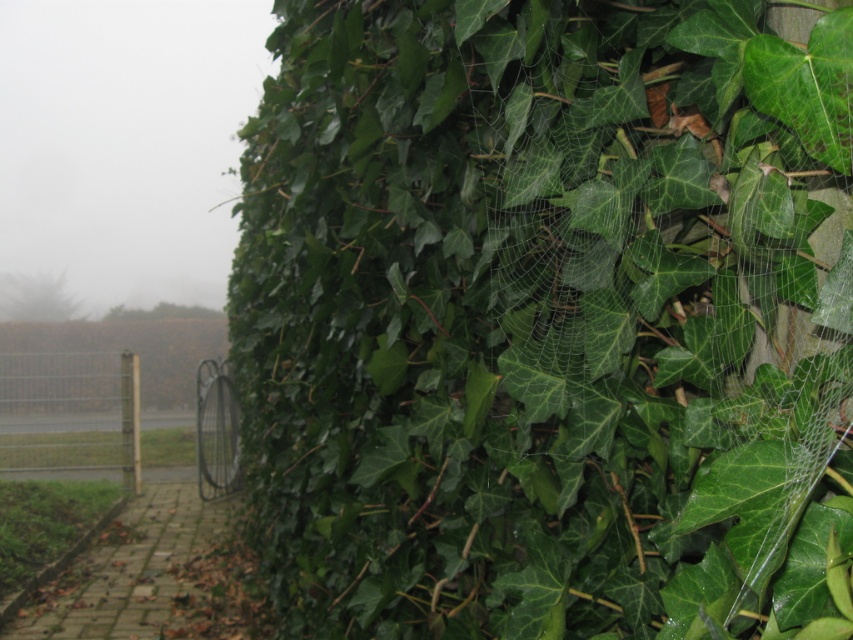
Is green leafy spider web at upper right further to the viewer compared to metallic wire fence at left?

No, green leafy spider web at upper right is closer to the viewer.

Is point (595, 419) farther from viewer compared to point (91, 355)?

That is False.

Does point (251, 465) lie behind point (122, 444)?

No, it is not.

Image resolution: width=853 pixels, height=640 pixels. Find the location of `green leafy spider web at upper right`. green leafy spider web at upper right is located at coordinates (550, 317).